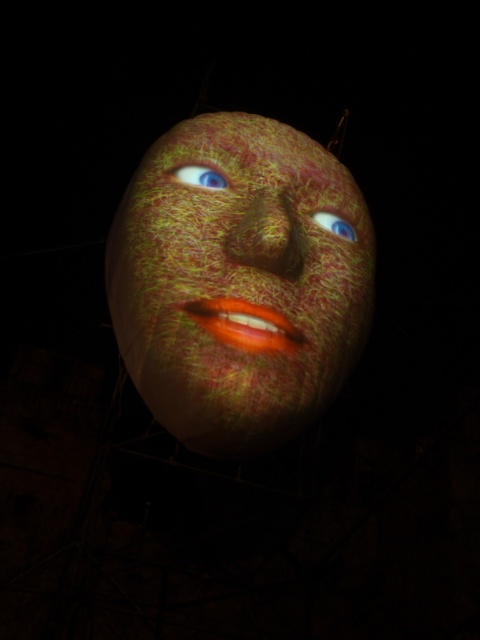
Question: Which point appears farthest from the camera in this image?

Choices:
 (A) (239, 412)
 (B) (328, 221)
 (C) (218, 182)
 (D) (262, 230)

Answer: (B)

Question: Which point is farther from the camera taking this photo?

Choices:
 (A) (345, 230)
 (B) (196, 164)
 (C) (216, 166)
 (D) (228, 234)

Answer: (A)

Question: Which object is positioned farthest from the speckled fabric mask at center?

Choices:
 (A) blue matte eye at center
 (B) matte textured nose at center

Answer: (A)

Question: Can you confirm if speckled fabric mask at center is positioned to the right of blue matte eye at center?

Choices:
 (A) yes
 (B) no

Answer: (B)

Question: Is matte textured nose at center below blue matte eye at center?

Choices:
 (A) yes
 (B) no

Answer: (A)

Question: Observing the image, what is the correct spatial positioning of speckled fabric mask at center in reference to blue matte eye at center?

Choices:
 (A) left
 (B) right

Answer: (A)